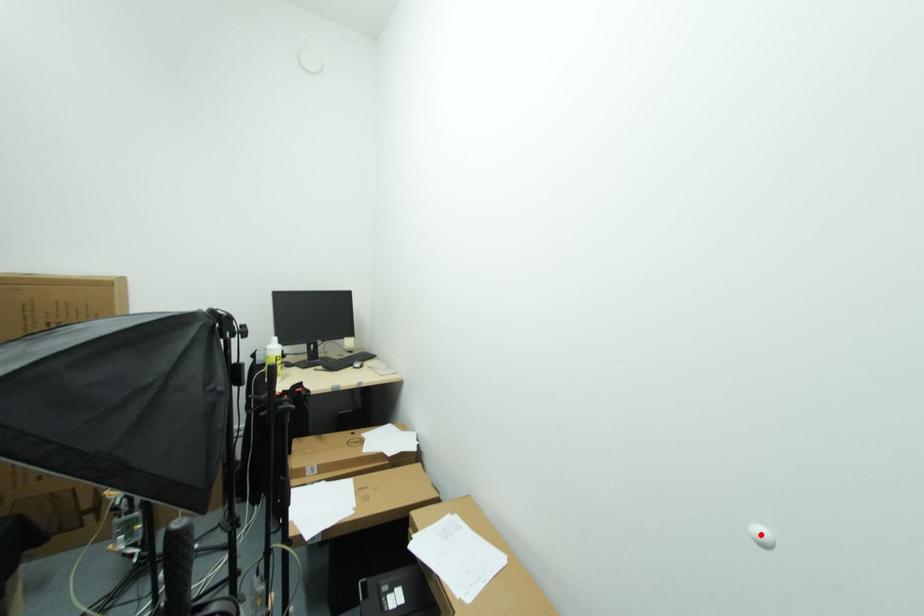
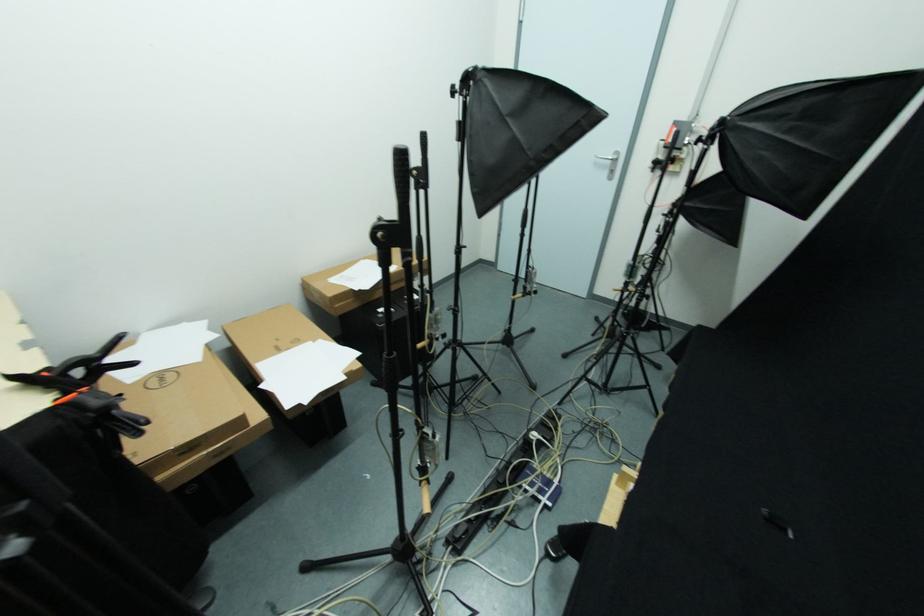
Question: I am providing you with two images of the same scene from different viewpoints. A red point is marked on the first image. Is the red point's position out of view in image 2?

Choices:
 (A) Yes
 (B) No

Answer: (A)